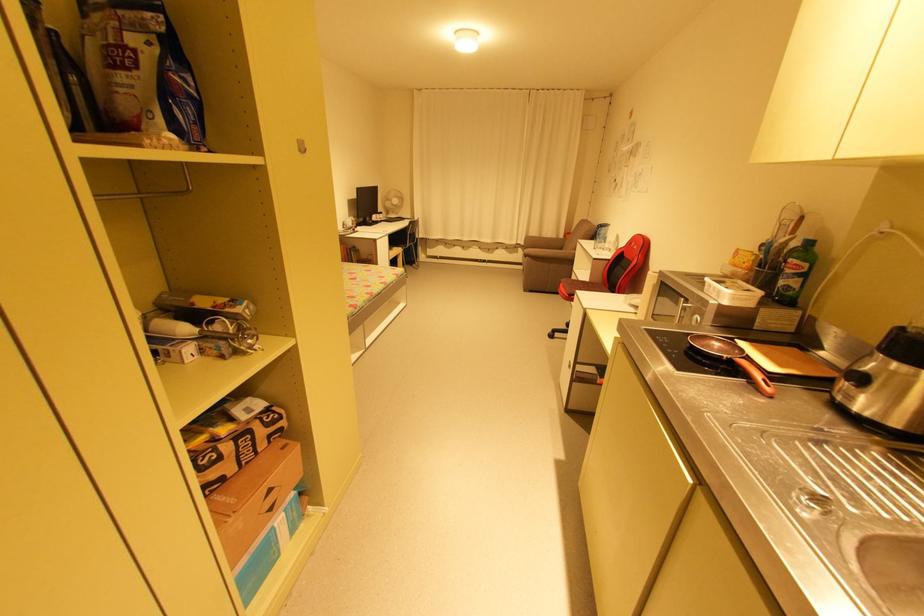
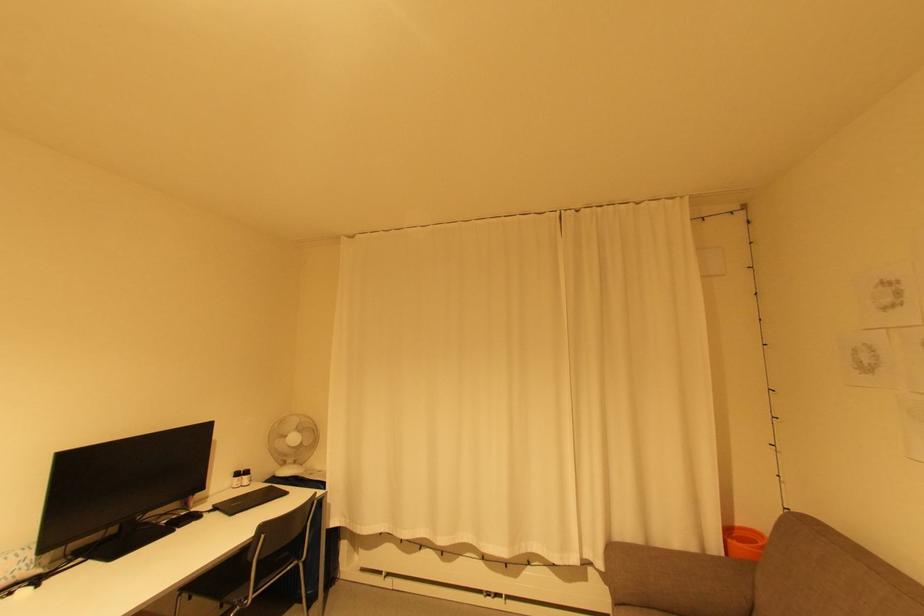
Find the pixel in the second image that matches [399,201] in the first image.

(298, 439)